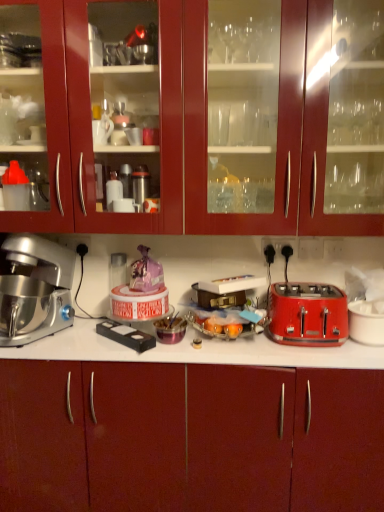
Question: From a real-world perspective, is silver metallic stand mixer at left physically located above or below red plastic toaster at right?

Choices:
 (A) below
 (B) above

Answer: (B)

Question: In terms of width, does silver metallic stand mixer at left look wider or thinner when compared to red plastic toaster at right?

Choices:
 (A) wide
 (B) thin

Answer: (A)

Question: Which object is positioned closest to the matte wood cabinet at lower center, arranged as the first cabinetry when ordered from the bottom?

Choices:
 (A) black plastic electrical outlet at upper right
 (B) black plastic remote control at center
 (C) red plastic toaster at right
 (D) silver metallic stand mixer at left
 (E) glossy wood cabinets at upper center, marked as the 1th cabinetry in a top-to-bottom arrangement

Answer: (C)

Question: Which object is positioned closest to the glossy wood cabinets at upper center, the 2th cabinetry from the bottom?

Choices:
 (A) black plastic electrical outlet at upper right
 (B) silver metallic stand mixer at left
 (C) black plastic remote control at center
 (D) matte wood cabinet at lower center, arranged as the first cabinetry when ordered from the bottom
 (E) red plastic toaster at right

Answer: (B)